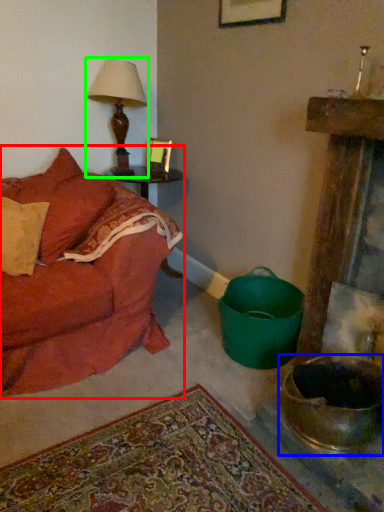
Question: Which object is the farthest from studio couch (highlighted by a red box)? Choose among these: mixing bowl (highlighted by a blue box) or table lamp (highlighted by a green box).

Choices:
 (A) mixing bowl
 (B) table lamp

Answer: (A)